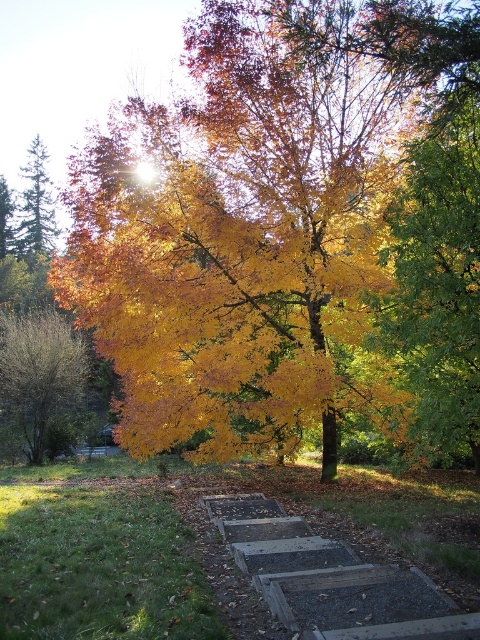
Is concrete steps at center below brown textured bush at left?

Correct, concrete steps at center is located below brown textured bush at left.

Based on the photo, is concrete steps at center positioned behind brown textured bush at left?

No, it is in front of brown textured bush at left.

Is point (229, 540) less distant than point (36, 410)?

Yes, point (229, 540) is closer to viewer.

At what (x,y) coordinates should I click in order to perform the action: click on concrete steps at center. Please return your answer as a coordinate pair (x, y). The height and width of the screenshot is (640, 480). Looking at the image, I should click on (331, 579).

Is brown textured bush at left further to camera compared to green matte evergreen tree at left?

No, brown textured bush at left is closer to the viewer.

Locate an element on the screen. This screenshot has height=640, width=480. brown textured bush at left is located at coordinates (37, 376).

Which is more to the left, concrete steps at center or green matte evergreen tree at left?

From the viewer's perspective, green matte evergreen tree at left appears more on the left side.

Does point (295, 529) come closer to viewer compared to point (46, 172)?

Yes, it is in front of point (46, 172).

Find the location of a particular element. The width and height of the screenshot is (480, 640). concrete steps at center is located at coordinates click(x=331, y=579).

The width and height of the screenshot is (480, 640). Identify the location of concrete steps at center. (331, 579).